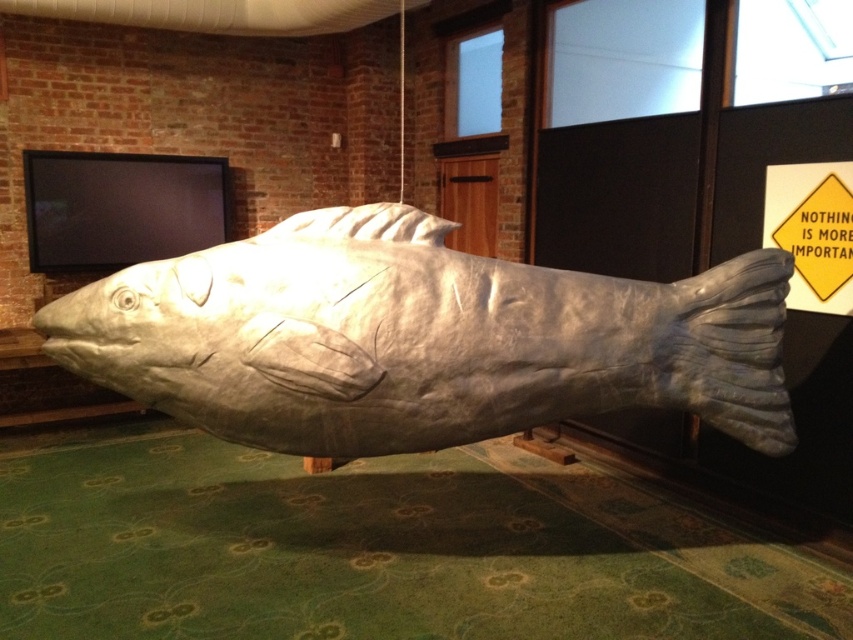
Question: Does metallic fish at center appear on the right side of yellow paper sign at upper right?

Choices:
 (A) no
 (B) yes

Answer: (A)

Question: Is metallic fish at center to the left of yellow paper sign at upper right from the viewer's perspective?

Choices:
 (A) no
 (B) yes

Answer: (B)

Question: Is metallic fish at center to the left of yellow paper sign at upper right from the viewer's perspective?

Choices:
 (A) yes
 (B) no

Answer: (A)

Question: Which object appears farthest from the camera in this image?

Choices:
 (A) metallic fish at center
 (B) yellow paper sign at upper right

Answer: (B)

Question: Which of the following is the farthest from the observer?

Choices:
 (A) metallic fish at center
 (B) yellow paper sign at upper right

Answer: (B)